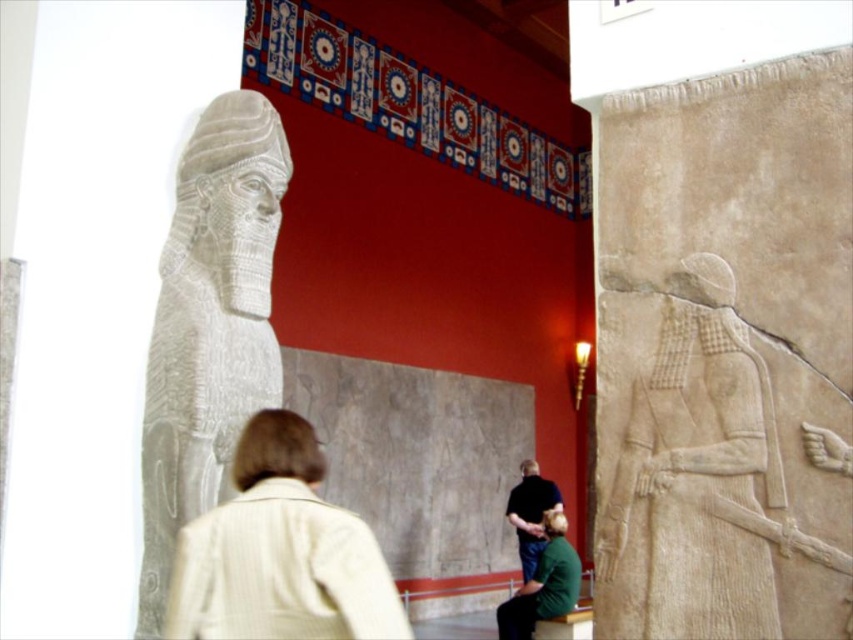
Who is taller, white stone statue at left or light beige jacket at center?

Standing taller between the two is white stone statue at left.

Is white stone statue at left to the right of light beige jacket at center from the viewer's perspective?

No, white stone statue at left is not to the right of light beige jacket at center.

Is point (200, 116) positioned after point (199, 586)?

Yes, point (200, 116) is farther from viewer.

The image size is (853, 640). Identify the location of white stone statue at left. [x=209, y=324].

In the scene shown: How much distance is there between gray stone relief at center and light beige jacket at center?

4.03 feet

Does point (682, 392) come behind point (236, 552)?

That is True.

I want to click on gray stone relief at center, so pyautogui.click(x=718, y=474).

Does white stone statue at left appear on the right side of green fabric shirt at lower center?

No, white stone statue at left is not to the right of green fabric shirt at lower center.

Who is positioned more to the right, white stone statue at left or green fabric shirt at lower center?

Positioned to the right is green fabric shirt at lower center.

Locate an element on the screen. The width and height of the screenshot is (853, 640). white stone statue at left is located at coordinates (209, 324).

In order to click on white stone statue at left in this screenshot , I will do `click(209, 324)`.